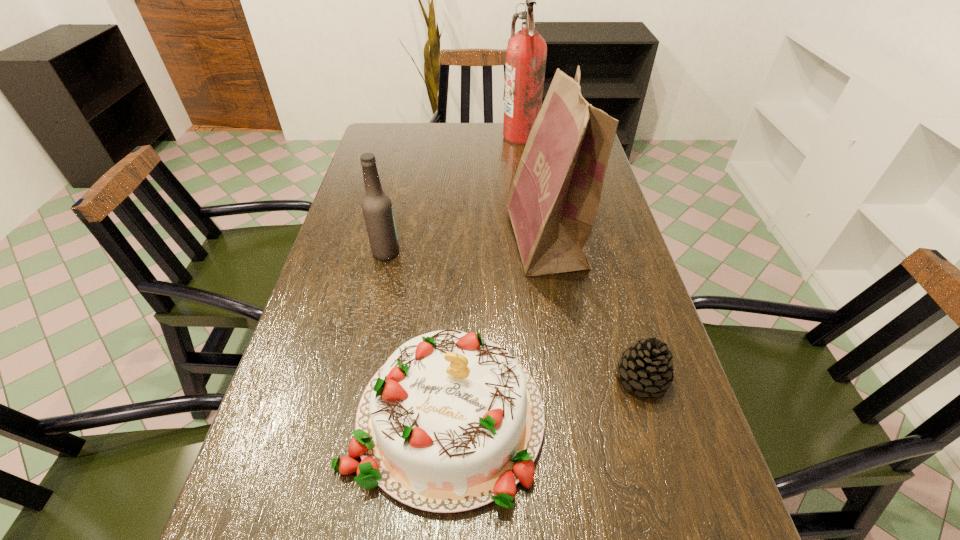
Locate an element on the screen. This screenshot has height=540, width=960. vacant region located on the front-facing side of the grocery bag is located at coordinates (434, 240).

Locate an element on the screen. This screenshot has width=960, height=540. vacant position located 0.160m on the side of the third tallest object with the label is located at coordinates (461, 252).

Image resolution: width=960 pixels, height=540 pixels. Find the location of `blank space located 0.220m on the back of the fourth tallest object`. blank space located 0.220m on the back of the fourth tallest object is located at coordinates [x=454, y=271].

At what (x,y) coordinates should I click in order to perform the action: click on free spot located 0.210m at the narrow end of the pinecone. Please return your answer as a coordinate pair (x, y). Looking at the image, I should click on (512, 377).

Where is `free region located at the narrow end of the pinecone`? The height and width of the screenshot is (540, 960). free region located at the narrow end of the pinecone is located at coordinates (433, 377).

Where is `blank space located at the narrow end of the pinecone`? blank space located at the narrow end of the pinecone is located at coordinates (576, 377).

Locate an element on the screen. The height and width of the screenshot is (540, 960). object situated at the far edge is located at coordinates (526, 53).

Where is `beer bottle situated at the left edge`? The height and width of the screenshot is (540, 960). beer bottle situated at the left edge is located at coordinates (377, 209).

The width and height of the screenshot is (960, 540). Find the location of `cake that is at the left edge`. cake that is at the left edge is located at coordinates (451, 422).

Find the location of a particular element. The height and width of the screenshot is (540, 960). grocery bag positioned at the right edge is located at coordinates (553, 201).